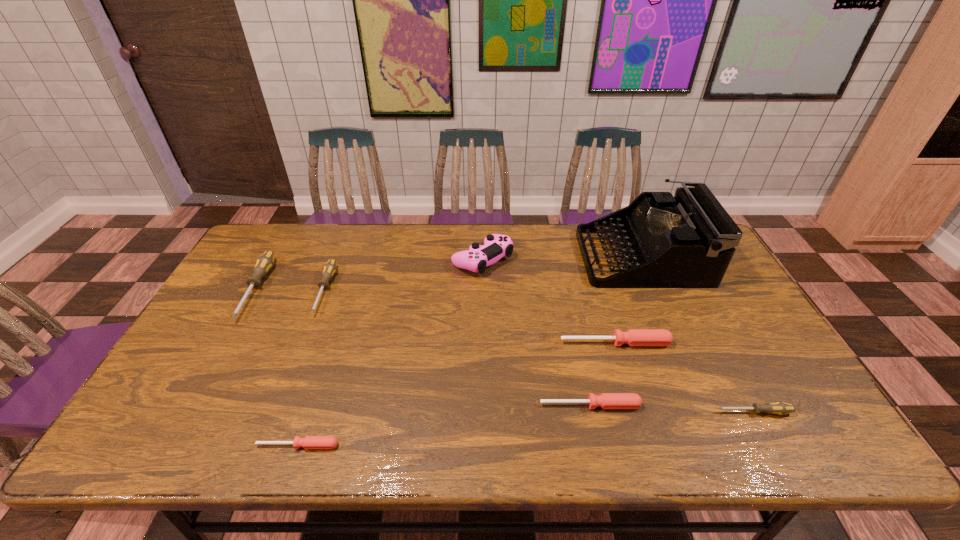
The width and height of the screenshot is (960, 540). What are the coordinates of `the closest screwdriver to the third farthest screwdriver` in the screenshot? It's located at (606, 400).

Locate which screwdriver is the fifth closest to the farthest red screwdriver. Please provide its 2D coordinates. Your answer should be formatted as a tuple, i.e. [(x, y)], where the tuple contains the x and y coordinates of a point satisfying the conditions above.

[(264, 263)]

Locate an element on the screen. gray screwdriver that is the third closest to the control is located at coordinates (780, 408).

Select which gray screwdriver appears as the second closest to the leftmost gray screwdriver. Please provide its 2D coordinates. Your answer should be formatted as a tuple, i.e. [(x, y)], where the tuple contains the x and y coordinates of a point satisfying the conditions above.

[(780, 408)]

Locate which red screwdriver is the third closest to the rightmost gray screwdriver. Please provide its 2D coordinates. Your answer should be formatted as a tuple, i.e. [(x, y)], where the tuple contains the x and y coordinates of a point satisfying the conditions above.

[(309, 442)]

The height and width of the screenshot is (540, 960). Find the location of `red screwdriver object that ranks as the second closest to the leftmost gray screwdriver`. red screwdriver object that ranks as the second closest to the leftmost gray screwdriver is located at coordinates (606, 400).

In order to click on vacant area in the image that satisfies the following two spatial constraints: 1. on the typing side of the tallest object; 2. on the front side of the shortest screwdriver in this screenshot , I will do `click(726, 446)`.

You are a GUI agent. You are given a task and a screenshot of the screen. Output one action in this format:
    pyautogui.click(x=<x>, y=<y>)
    Task: Click on the vacant space that satisfies the following two spatial constraints: 1. at the tip of the farthest red screwdriver; 2. on the right side of the leftmost object
    
    Given the screenshot: What is the action you would take?
    pyautogui.click(x=226, y=343)